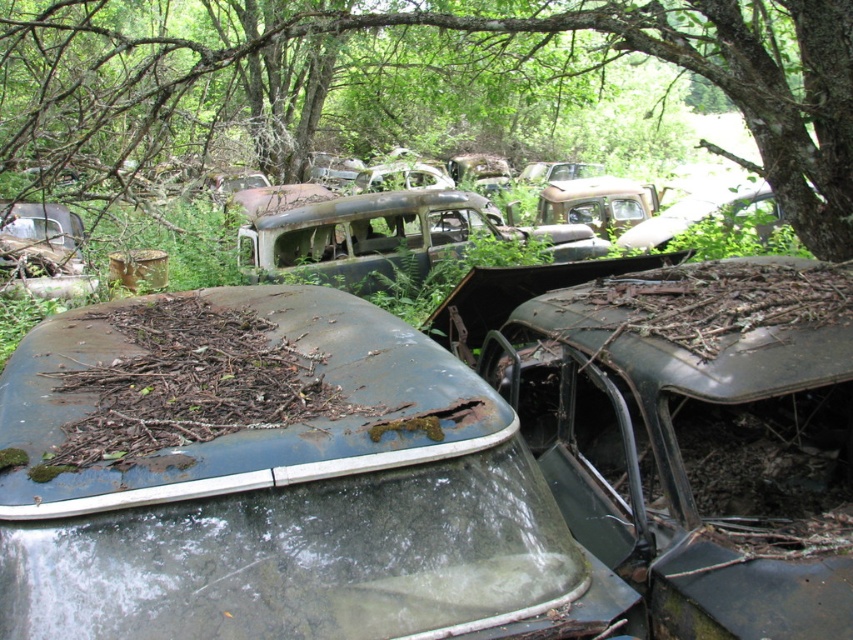
Question: Which point appears closest to the camera in this image?

Choices:
 (A) (178, 308)
 (B) (378, 17)

Answer: (A)

Question: Is green rough bark tree at upper center thinner than rusty metal roof at center?

Choices:
 (A) yes
 (B) no

Answer: (B)

Question: Does green rough bark tree at upper center appear over rusty metal roof at center?

Choices:
 (A) no
 (B) yes

Answer: (B)

Question: Does green rough bark tree at upper center come in front of rusty metal roof at center?

Choices:
 (A) yes
 (B) no

Answer: (B)

Question: Which object is closer to the camera taking this photo?

Choices:
 (A) green rough bark tree at upper center
 (B) rusty metal roof at center

Answer: (B)